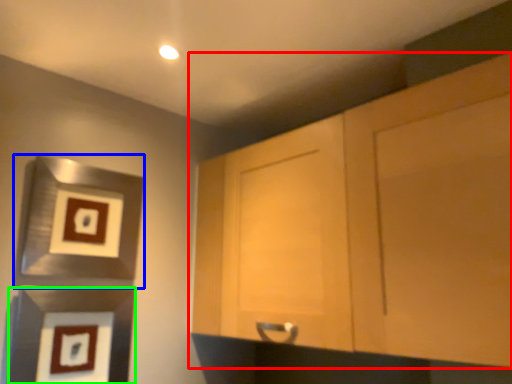
Question: Which is farther away from cabinetry (highlighted by a red box)? picture frame (highlighted by a blue box) or picture frame (highlighted by a green box)?

Choices:
 (A) picture frame
 (B) picture frame

Answer: (B)